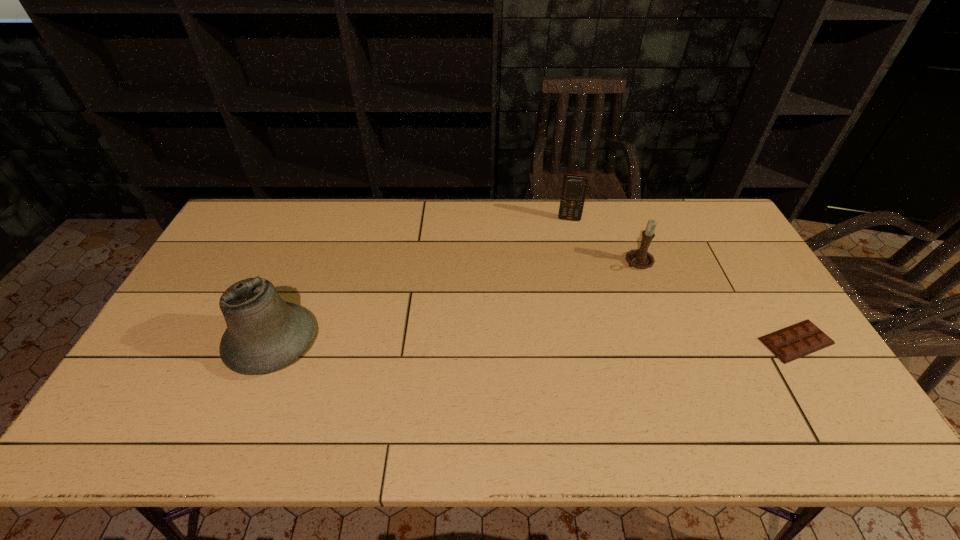
This screenshot has width=960, height=540. I want to click on bell, so click(264, 333).

Locate an element on the screen. This screenshot has width=960, height=540. the tallest object is located at coordinates (264, 333).

Find the location of a particular element. The image size is (960, 540). the shortest object is located at coordinates (793, 342).

Identify the location of the rightmost object. This screenshot has width=960, height=540. (793, 342).

Image resolution: width=960 pixels, height=540 pixels. In order to click on the third object from left to right in this screenshot , I will do `click(640, 258)`.

Identify the location of the second farthest object. tap(640, 258).

Find the location of `the second object from left to right`. the second object from left to right is located at coordinates (574, 188).

This screenshot has height=540, width=960. Find the location of `the farthest object`. the farthest object is located at coordinates (574, 188).

This screenshot has width=960, height=540. Find the location of `free region located on the back of the tallest object`. free region located on the back of the tallest object is located at coordinates (313, 242).

Image resolution: width=960 pixels, height=540 pixels. Identify the location of vacant region located on the back of the chocolate bar. (736, 246).